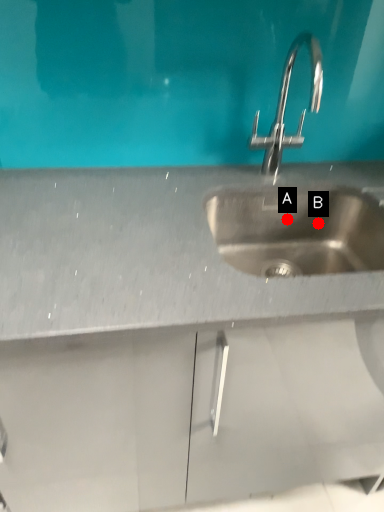
Question: Two points are circled on the image, labeled by A and B beside each circle. Which point appears farthest from the camera in this image?

Choices:
 (A) A is further
 (B) B is further

Answer: (B)